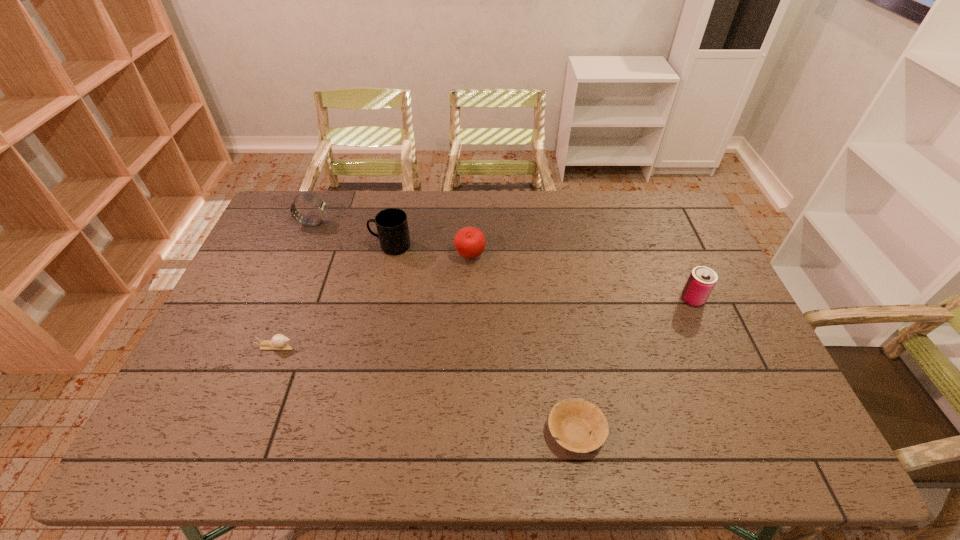
Where is `vacant space that satisfies the following two spatial constraints: 1. on the side of the third object from left to right with the handle; 2. on the right side of the nearest object`? The width and height of the screenshot is (960, 540). vacant space that satisfies the following two spatial constraints: 1. on the side of the third object from left to right with the handle; 2. on the right side of the nearest object is located at coordinates (352, 432).

Find the location of a particular element. The height and width of the screenshot is (540, 960). blank area in the image that satisfies the following two spatial constraints: 1. on the side of the mug with the handle; 2. on the right side of the bowl is located at coordinates (352, 432).

Locate an element on the screen. The width and height of the screenshot is (960, 540). vacant point that satisfies the following two spatial constraints: 1. on the side of the third object from left to right with the handle; 2. on the right side of the fourth object from left to right is located at coordinates (389, 256).

Locate an element on the screen. The height and width of the screenshot is (540, 960). vacant region that satisfies the following two spatial constraints: 1. on the back side of the fourth farthest object; 2. on the side of the mug with the handle is located at coordinates (669, 246).

At what (x,y) coordinates should I click in order to perform the action: click on vacant region that satisfies the following two spatial constraints: 1. on the front side of the third nearest object; 2. on the shell of the fifth farthest object. Please return your answer as a coordinate pair (x, y). Image resolution: width=960 pixels, height=540 pixels. Looking at the image, I should click on (713, 346).

Locate an element on the screen. vacant space that satisfies the following two spatial constraints: 1. on the face of the can; 2. on the right side of the watch is located at coordinates (281, 299).

Where is `blank area in the image that satisfies the following two spatial constraints: 1. on the face of the nearest object; 2. on the left side of the watch`? The image size is (960, 540). blank area in the image that satisfies the following two spatial constraints: 1. on the face of the nearest object; 2. on the left side of the watch is located at coordinates (227, 432).